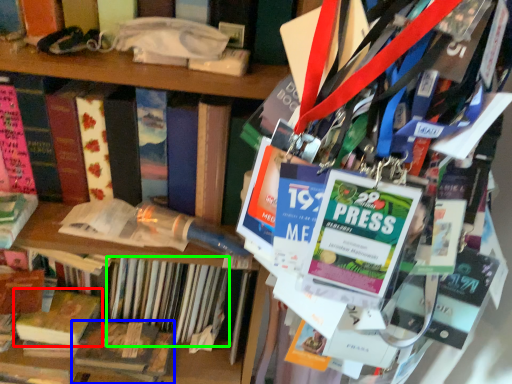
Question: Based on their relative distances, which object is farther from book (highlighted by a red box)? Choose from book (highlighted by a blue box) and book (highlighted by a green box).

Choices:
 (A) book
 (B) book

Answer: (B)